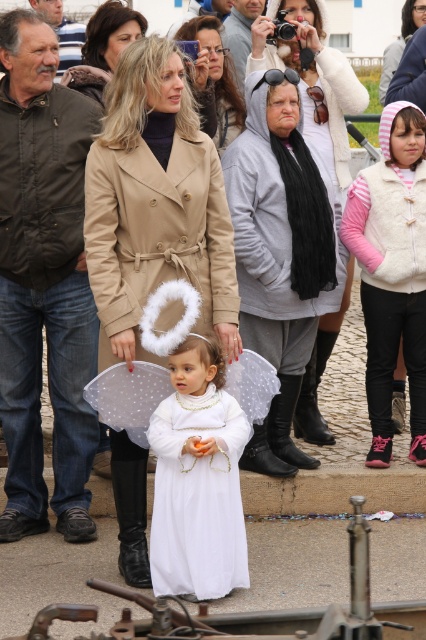
Question: Which of the following is the farthest from the observer?

Choices:
 (A) brown leather jacket at upper left
 (B) gray hoodie at center
 (C) matte beige coat at center
 (D) white fleece vest at right

Answer: (A)

Question: Does dark brown leather jacket at left come in front of beige wool coat at center?

Choices:
 (A) no
 (B) yes

Answer: (A)

Question: Observing the image, what is the correct spatial positioning of matte beige coat at center in reference to matte gray hoodie at center?

Choices:
 (A) above
 (B) below

Answer: (B)

Question: Which of the following is the farthest from the observer?

Choices:
 (A) matte beige coat at center
 (B) smooth beige coat at center

Answer: (B)

Question: In this image, where is gray hoodie at center located relative to smooth beige coat at upper center?

Choices:
 (A) below
 (B) above

Answer: (A)

Question: Which object is farther from the camera taking this photo?

Choices:
 (A) white fleece vest at right
 (B) matte beige coat at center

Answer: (B)